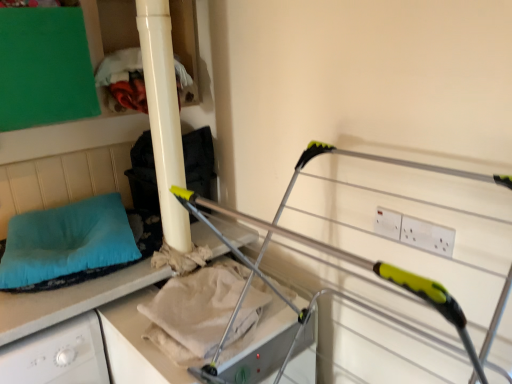
Question: Considering the relative positions of teal fabric pillow at left and metallic silver drying rack at center in the image provided, is teal fabric pillow at left to the left of metallic silver drying rack at center from the viewer's perspective?

Choices:
 (A) yes
 (B) no

Answer: (A)

Question: Can you confirm if teal fabric pillow at left is smaller than metallic silver drying rack at center?

Choices:
 (A) no
 (B) yes

Answer: (B)

Question: Is teal fabric pillow at left placed right next to metallic silver drying rack at center?

Choices:
 (A) yes
 (B) no

Answer: (B)

Question: Is the position of teal fabric pillow at left more distant than that of metallic silver drying rack at center?

Choices:
 (A) no
 (B) yes

Answer: (B)

Question: Is teal fabric pillow at left not inside metallic silver drying rack at center?

Choices:
 (A) yes
 (B) no

Answer: (A)

Question: In the image, is matte white pillar at upper left on the left side or the right side of beige cotton sheet at center?

Choices:
 (A) left
 (B) right

Answer: (A)

Question: Considering the positions of point (163, 13) and point (223, 324), is point (163, 13) closer or farther from the camera than point (223, 324)?

Choices:
 (A) closer
 (B) farther

Answer: (B)

Question: Based on their sizes in the image, would you say matte white pillar at upper left is bigger or smaller than beige cotton sheet at center?

Choices:
 (A) big
 (B) small

Answer: (A)

Question: From a real-world perspective, is matte white pillar at upper left above or below beige cotton sheet at center?

Choices:
 (A) below
 (B) above

Answer: (B)

Question: Considering their positions, is teal fabric pillow at left located in front of or behind matte white pillar at upper left?

Choices:
 (A) front
 (B) behind

Answer: (B)

Question: Does point (82, 210) appear closer or farther from the camera than point (151, 38)?

Choices:
 (A) farther
 (B) closer

Answer: (A)

Question: From a real-world perspective, is teal fabric pillow at left above or below matte white pillar at upper left?

Choices:
 (A) below
 (B) above

Answer: (A)

Question: In the image, is teal fabric pillow at left on the left side or the right side of matte white pillar at upper left?

Choices:
 (A) left
 (B) right

Answer: (A)

Question: From the image's perspective, relative to beige cotton sheet at center, is teal fabric pillow at left above or below?

Choices:
 (A) below
 (B) above

Answer: (B)

Question: Would you say teal fabric pillow at left is to the left or to the right of beige cotton sheet at center in the picture?

Choices:
 (A) left
 (B) right

Answer: (A)